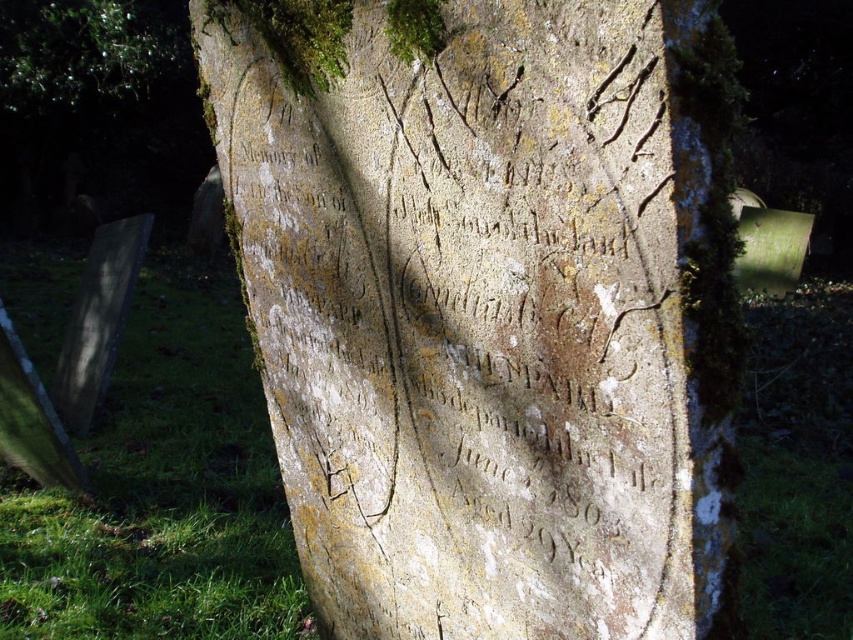
Does weathered stone gravestone at center appear over green grass at center?

Yes, weathered stone gravestone at center is above green grass at center.

Does weathered stone gravestone at center appear on the right side of green grass at center?

Indeed, weathered stone gravestone at center is positioned on the right side of green grass at center.

The height and width of the screenshot is (640, 853). What do you see at coordinates (490, 305) in the screenshot?
I see `weathered stone gravestone at center` at bounding box center [490, 305].

I want to click on weathered stone gravestone at center, so click(490, 305).

In the scene shown: Who is more distant from viewer, [779,584] or [47,72]?

Positioned behind is point [47,72].

Which is above, green grass at center or green mossy tree at upper left?

green mossy tree at upper left is above.

Find the location of `green grass at center`. green grass at center is located at coordinates (161, 496).

Does weathered stone gravestone at center have a greater height compared to green mossy tree at upper left?

In fact, weathered stone gravestone at center may be shorter than green mossy tree at upper left.

Does weathered stone gravestone at center appear on the left side of green mossy tree at upper left?

Incorrect, weathered stone gravestone at center is not on the left side of green mossy tree at upper left.

Which is in front, point (393, 193) or point (9, 116)?

Point (393, 193)

This screenshot has width=853, height=640. I want to click on weathered stone gravestone at center, so click(x=490, y=305).